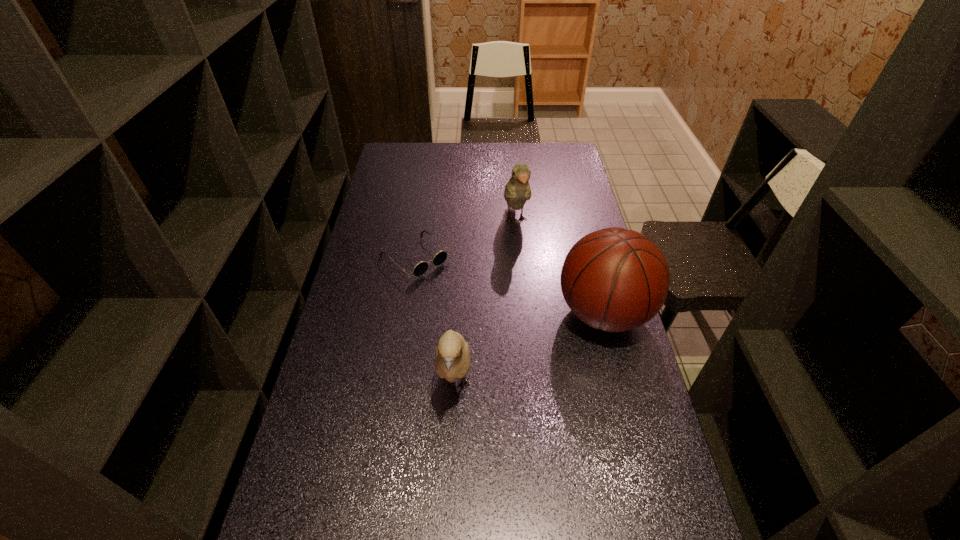
Where is `the nearer bird`? The height and width of the screenshot is (540, 960). the nearer bird is located at coordinates (452, 360).

Locate an element on the screen. basketball is located at coordinates (614, 279).

Identify the location of the right bird. (517, 191).

Where is `the farther bird`? This screenshot has width=960, height=540. the farther bird is located at coordinates (517, 191).

Find the location of a particular element. sunglasses is located at coordinates (420, 268).

This screenshot has height=540, width=960. I want to click on vacant space located at the beak of the nearer bird, so click(x=451, y=473).

Identify the location of free location located on the front of the rightmost object. The image size is (960, 540). (623, 389).

The image size is (960, 540). Find the location of `vacant region located 0.170m at the face of the farther bird`. vacant region located 0.170m at the face of the farther bird is located at coordinates (525, 271).

The width and height of the screenshot is (960, 540). Find the location of `free point located 0.370m at the face of the farther bird`. free point located 0.370m at the face of the farther bird is located at coordinates click(535, 314).

Identify the location of free space located at the face of the farther bird. This screenshot has height=540, width=960. (530, 291).